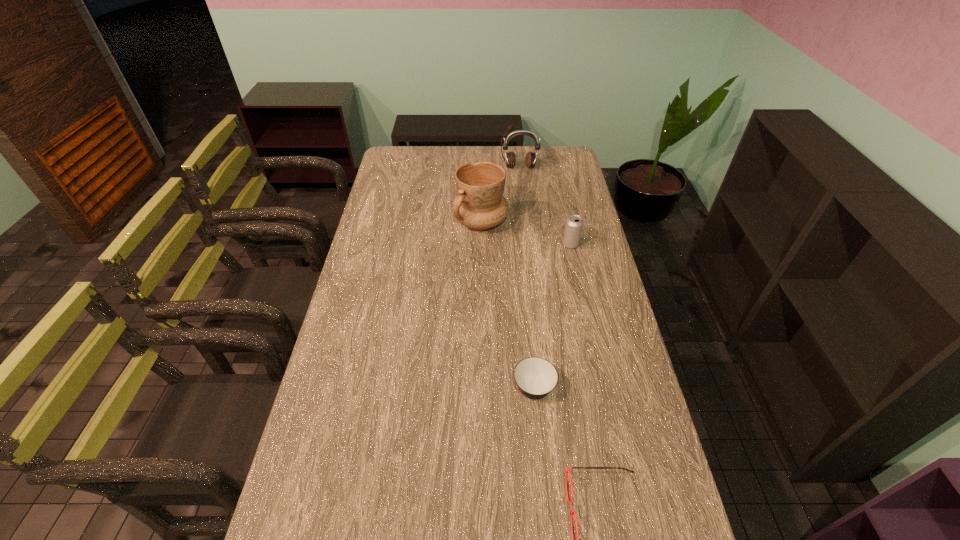
Locate an element on the screen. The image size is (960, 540). pottery is located at coordinates (479, 205).

At what (x,y) coordinates should I click in order to perform the action: click on the farthest object. Please return your answer as a coordinate pair (x, y). Looking at the image, I should click on (510, 159).

Find the location of a particular element. beer can is located at coordinates (574, 224).

The image size is (960, 540). Find the location of `the fourth farthest object`. the fourth farthest object is located at coordinates (536, 377).

Locate an element on the screen. The height and width of the screenshot is (540, 960). free region located on the back of the pottery is located at coordinates (480, 179).

This screenshot has width=960, height=540. I want to click on vacant position located 0.310m on the ear pads of the farthest object, so click(x=524, y=213).

Where is `vacant area situated on the front of the third shortest object`? This screenshot has width=960, height=540. vacant area situated on the front of the third shortest object is located at coordinates (590, 332).

Identify the location of free space located 0.200m on the front of the soup bowl. (543, 485).

You are a GUI agent. You are given a task and a screenshot of the screen. Output one action in this format:
    pyautogui.click(x=<x>, y=<y>)
    Task: Click on the object that is at the far edge
    The height and width of the screenshot is (540, 960).
    Given the screenshot: What is the action you would take?
    pyautogui.click(x=510, y=159)

Identify the location of object situated at the right edge. (574, 224).